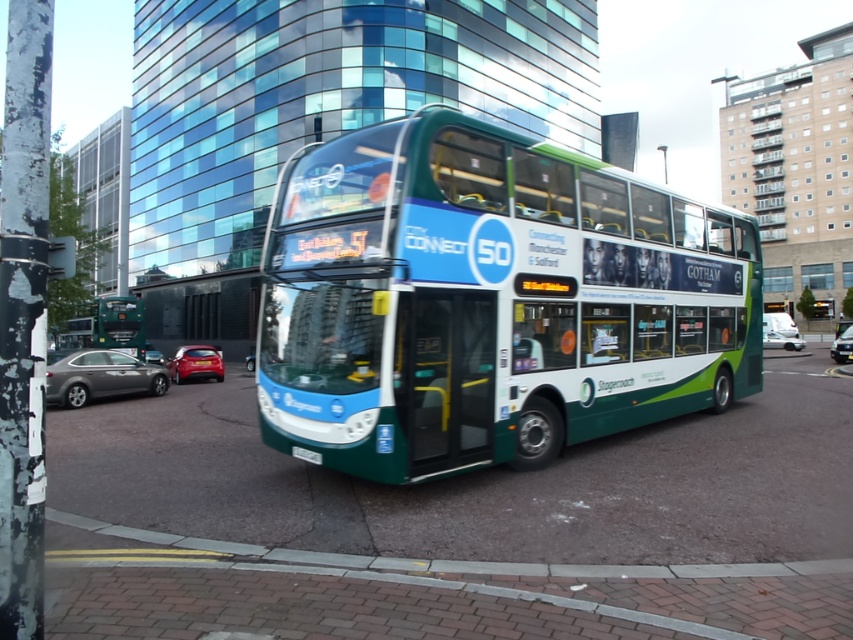
You are a pedestrian standing at the crosswalk, and you need to cross the street. There is a metallic gray sedan at lower left and a metallic silver car at center. Which car is closer to you?

The metallic gray sedan at lower left is closer to you because it is in front of the metallic silver car at center.